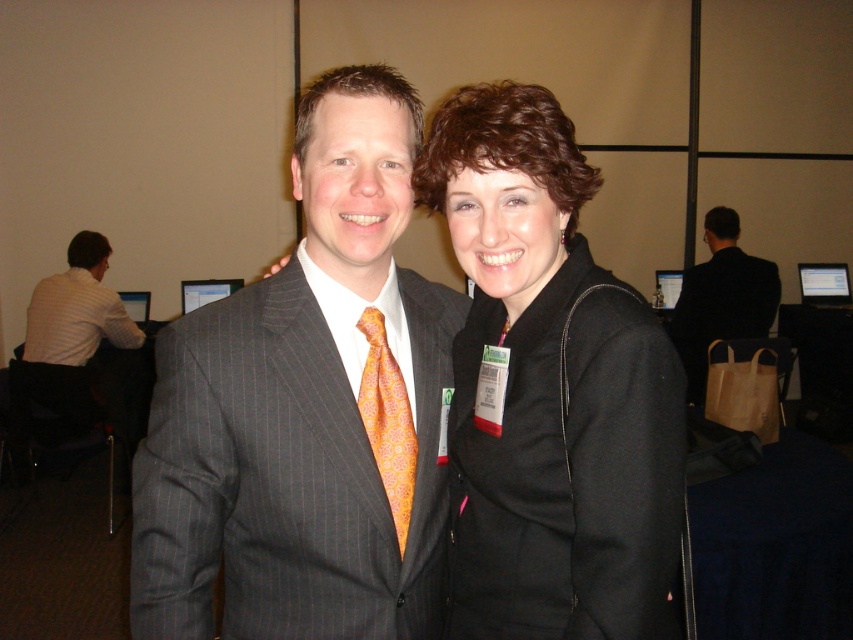
Between black wool coat at center and black suit at right, which one is positioned higher?

black suit at right is above.

Who is shorter, black wool coat at center or black suit at right?

black wool coat at center is shorter.

Between point (540, 600) and point (677, 349), which one is positioned in front?

Point (540, 600) is more forward.

Find the location of `black wool coat at center`. black wool coat at center is located at coordinates (550, 388).

Does matte pinstripe suit at center come in front of orange silk tie at center?

Yes.

Based on the photo, which is more to the left, matte pinstripe suit at center or orange silk tie at center?

matte pinstripe suit at center

Describe the element at coordinates (306, 410) in the screenshot. I see `matte pinstripe suit at center` at that location.

I want to click on matte pinstripe suit at center, so click(306, 410).

Does matte pinstripe suit at center have a larger size compared to black wool coat at center?

Indeed, matte pinstripe suit at center has a larger size compared to black wool coat at center.

Does point (204, 522) come behind point (666, 547)?

Yes, point (204, 522) is behind point (666, 547).

Who is more distant from viewer, (x=428, y=344) or (x=544, y=454)?

Point (x=428, y=344)

The height and width of the screenshot is (640, 853). Find the location of `matte pinstripe suit at center`. matte pinstripe suit at center is located at coordinates (306, 410).